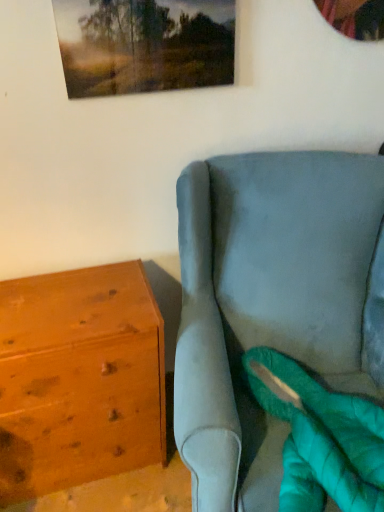
Question: Is matte wooden picture frame at upper center taller or shorter than wooden chest of drawers at left?

Choices:
 (A) tall
 (B) short

Answer: (B)

Question: Is matte wooden picture frame at upper center in front of or behind wooden chest of drawers at left in the image?

Choices:
 (A) front
 (B) behind

Answer: (A)

Question: From the image's perspective, is matte wooden picture frame at upper center located above or below wooden chest of drawers at left?

Choices:
 (A) below
 (B) above

Answer: (B)

Question: Looking at their shapes, would you say wooden chest of drawers at left is wider or thinner than matte wooden picture frame at upper center?

Choices:
 (A) wide
 (B) thin

Answer: (A)

Question: Visually, is wooden chest of drawers at left positioned to the left or to the right of matte wooden picture frame at upper center?

Choices:
 (A) right
 (B) left

Answer: (B)

Question: Is wooden chest of drawers at left in front of or behind matte wooden picture frame at upper center in the image?

Choices:
 (A) behind
 (B) front

Answer: (A)

Question: In terms of height, does wooden chest of drawers at left look taller or shorter compared to matte wooden picture frame at upper center?

Choices:
 (A) tall
 (B) short

Answer: (A)